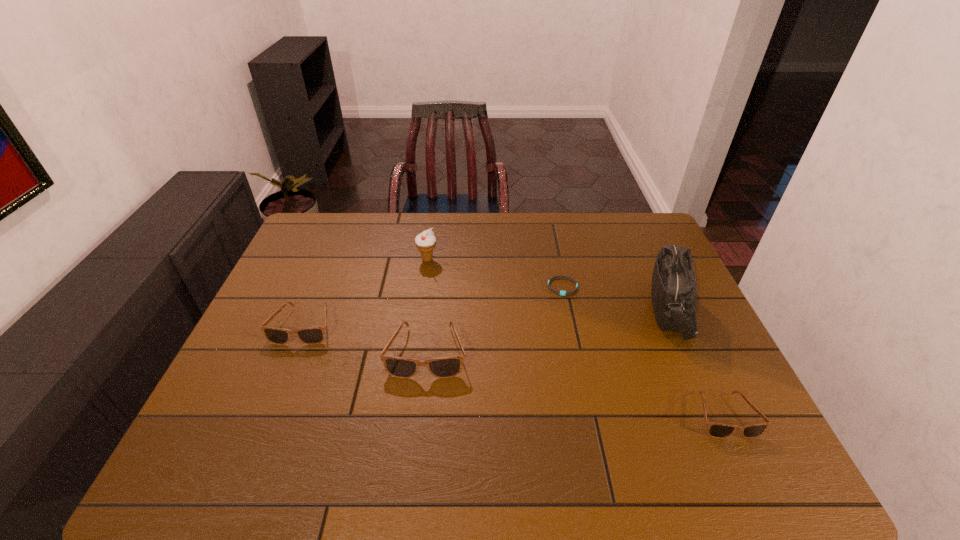
This screenshot has height=540, width=960. What are the coordinates of `free area in between the wristband and the tallest object` in the screenshot? It's located at (617, 299).

In order to click on unoccupied position between the tallest sunglasses and the tallest object in this screenshot , I will do (549, 331).

This screenshot has height=540, width=960. In order to click on empty location between the fifth tallest object and the wristband in this screenshot , I will do `click(643, 351)`.

At what (x,y) coordinates should I click in order to perform the action: click on blank region between the second tallest sunglasses and the farthest object. Please return your answer as a coordinate pair (x, y). The width and height of the screenshot is (960, 540). Looking at the image, I should click on (366, 293).

Identify the location of vacant area that lies between the farthest object and the fourth shortest object. (427, 306).

Where is `free spot between the leftmost sunglasses and the second shortest object`? This screenshot has width=960, height=540. free spot between the leftmost sunglasses and the second shortest object is located at coordinates (515, 370).

Where is `free spot between the second shortest object and the second sunglasses from left to right`? free spot between the second shortest object and the second sunglasses from left to right is located at coordinates coord(576,384).

Identify the location of unoccupied area between the second shortest sunglasses and the tallest object. (488, 318).

Locate an element on the screen. The height and width of the screenshot is (540, 960). object that is the second closest to the leftmost object is located at coordinates (425, 242).

The image size is (960, 540). I want to click on object identified as the third closest to the third object from right to left, so click(x=425, y=242).